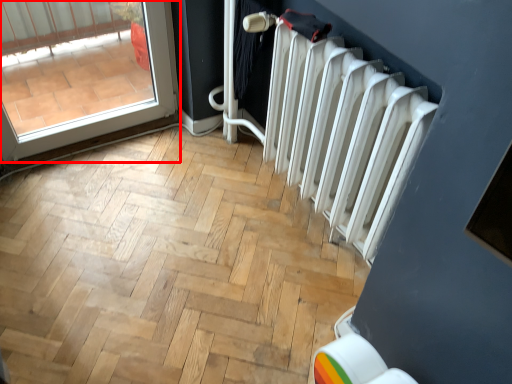
Question: In this image, where is door (annotated by the red box) located relative to radiator?

Choices:
 (A) left
 (B) right

Answer: (A)